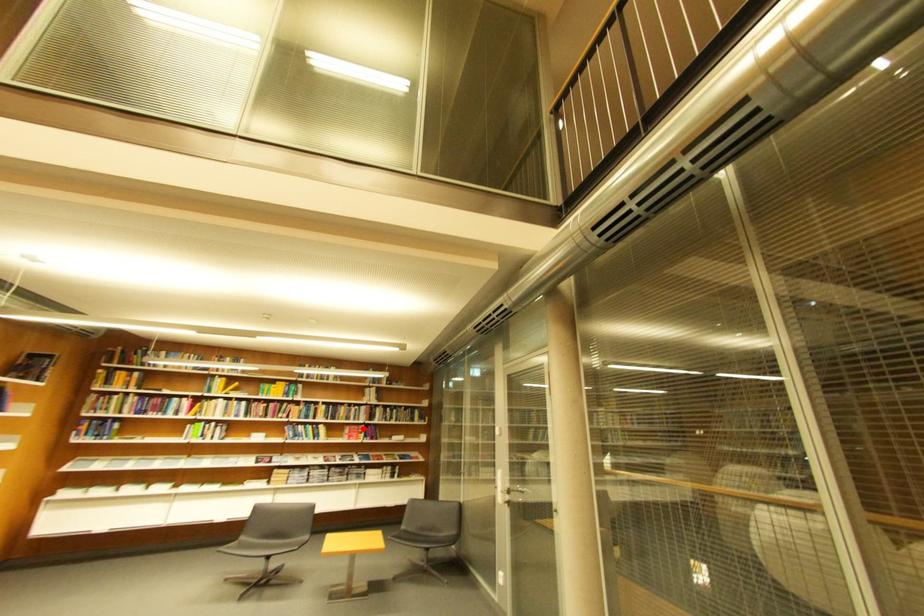
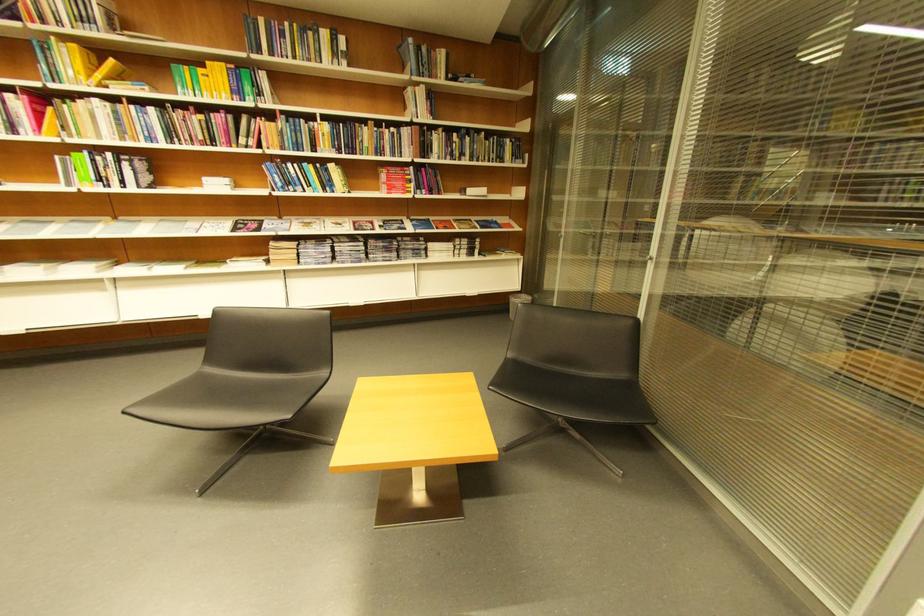
Question: I am providing you with two images of the same scene from different viewpoints. Given a red point in image1, look at the same physical point in image2. Is it:

Choices:
 (A) Closer to the viewpoint
 (B) Farther from the viewpoint

Answer: (A)